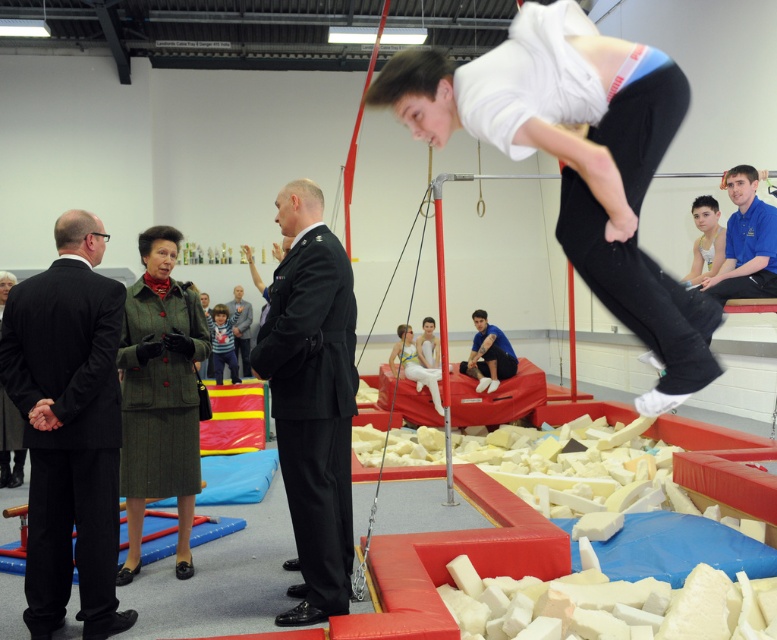
You are standing in the gymnasium and want to take a photo of the white matte gymnast at upper center. If your camera has a focal length of 50mm and you want to capture the gymnast clearly, should you adjust your position closer or farther away?

The white matte gymnast at upper center is 2.07 meters away from the viewer. To capture the gymnast clearly with a 50mm lens, you should stay at your current distance since 50mm is suitable for portraits at around 2 meters. Moving closer might cause distortion, while moving farther could make the gymnast too small in the frame.

You are a spectator sitting in the gymnasium and want to take a photo of both the white matte gymnast at upper center and the black uniform at center. Which one should you pan your camera to first to capture both in the frame?

You should pan your camera to the white matte gymnast at upper center first because it is to the right of the black uniform at center, so capturing it first allows both to be in the frame.